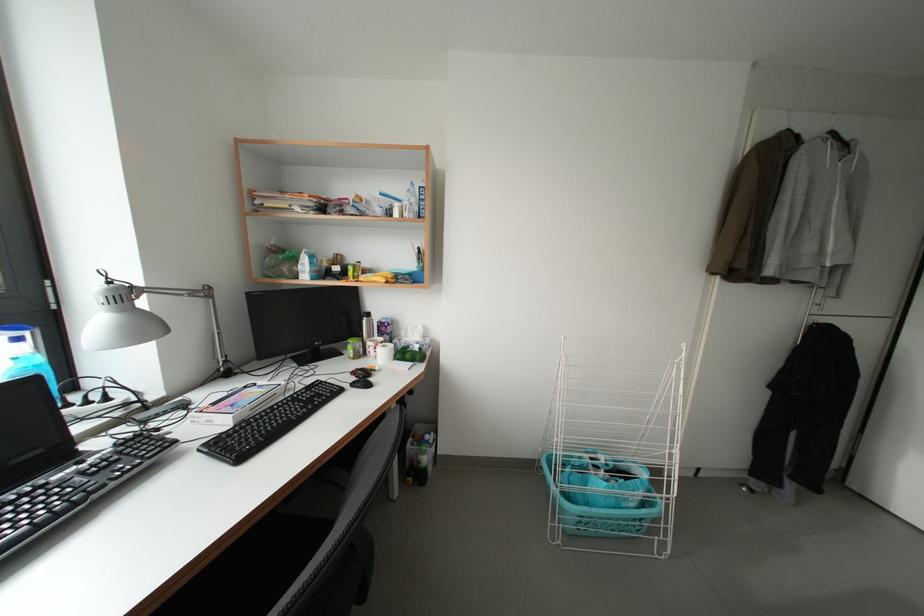
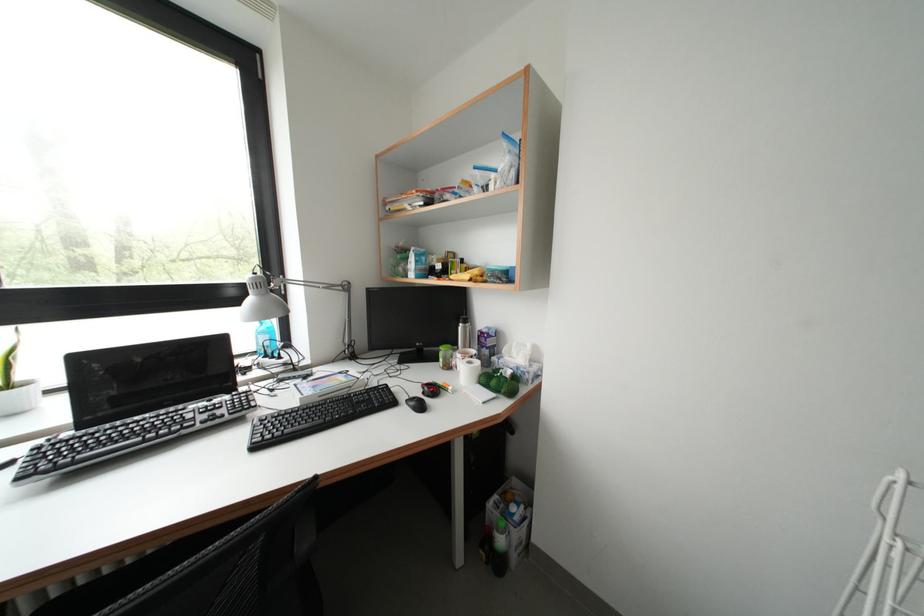
Question: How did the camera likely rotate?

Choices:
 (A) Left
 (B) Right
 (C) Up
 (D) Down

Answer: (A)